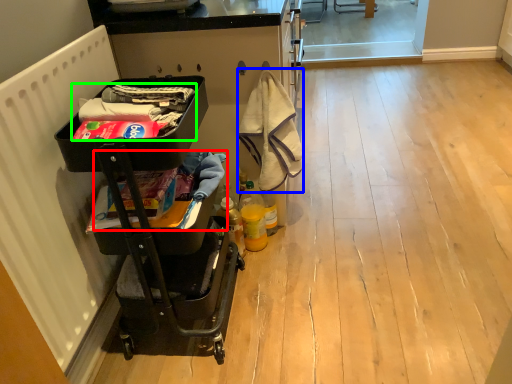
Question: Considering the real-world distances, which object is farthest from laundry (highlighted by a red box)? material (highlighted by a blue box) or laundry (highlighted by a green box)?

Choices:
 (A) material
 (B) laundry

Answer: (A)